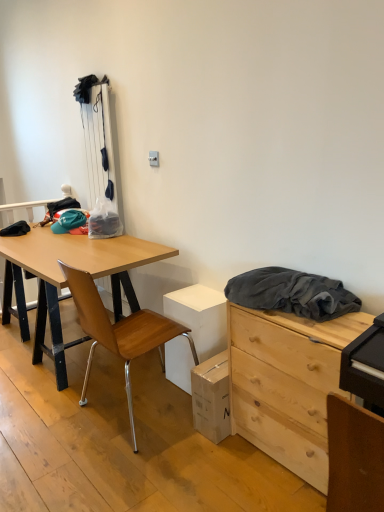
Identify the location of vacant space situated on the left part of natural wood chest of drawers at right. This screenshot has width=384, height=512. (197, 470).